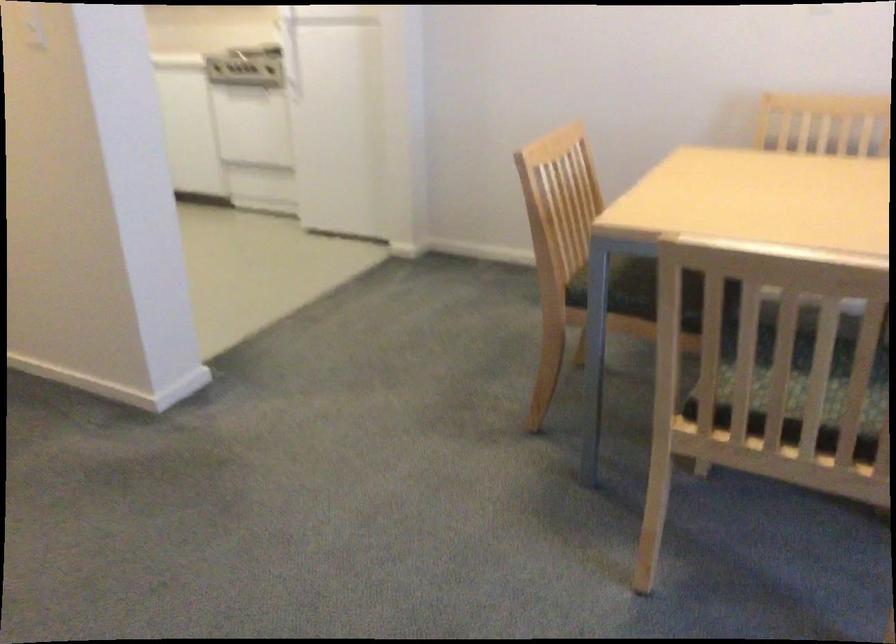
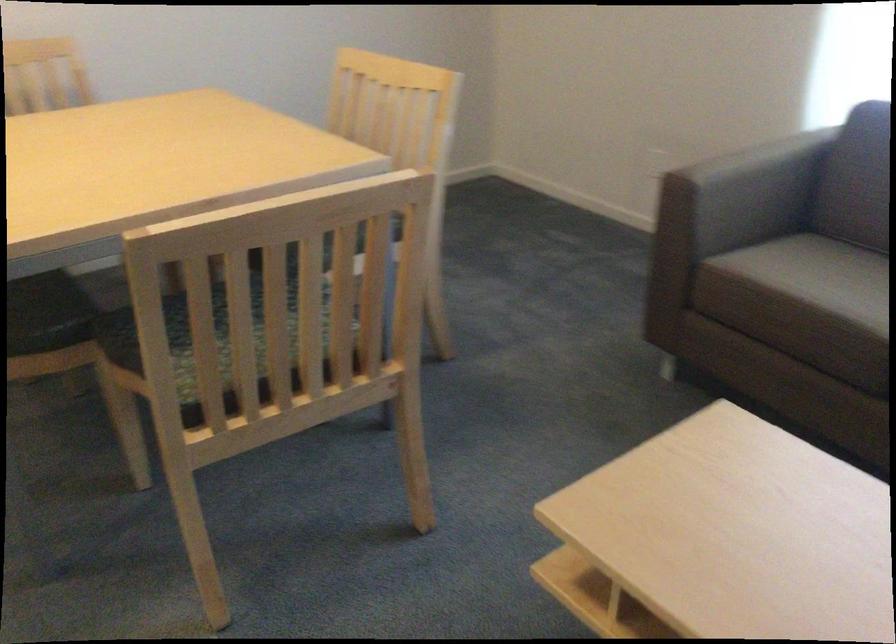
The point at (686, 299) is marked in the first image. Where is the corresponding point in the second image?

(47, 313)